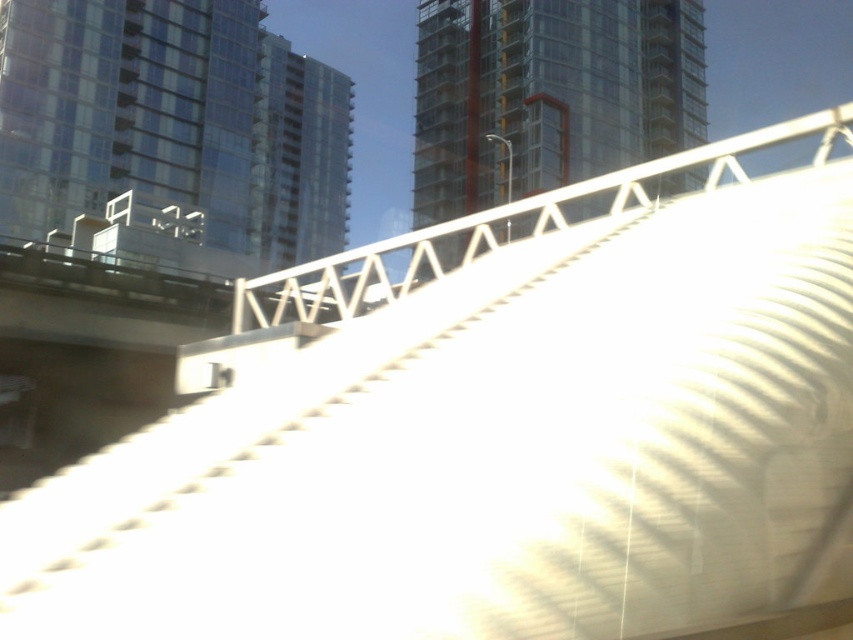
You are an architect observing the urban scene. You notice the transparent glass tower at upper center and the transparent glass building at center. Which of these two structures is located higher up in the image?

The transparent glass tower at upper center is positioned under the transparent glass building at center, meaning the transparent glass building at center is higher up in the image.

You are standing in front of the curved metallic structure in the urban scene. There are two points marked on the structure at coordinates point (648, 125) and point (265, 113). Which point is nearer to your viewpoint?

Point (648, 125) is closer to the camera than point (265, 113), so the point (648, 125) is nearer to your viewpoint.